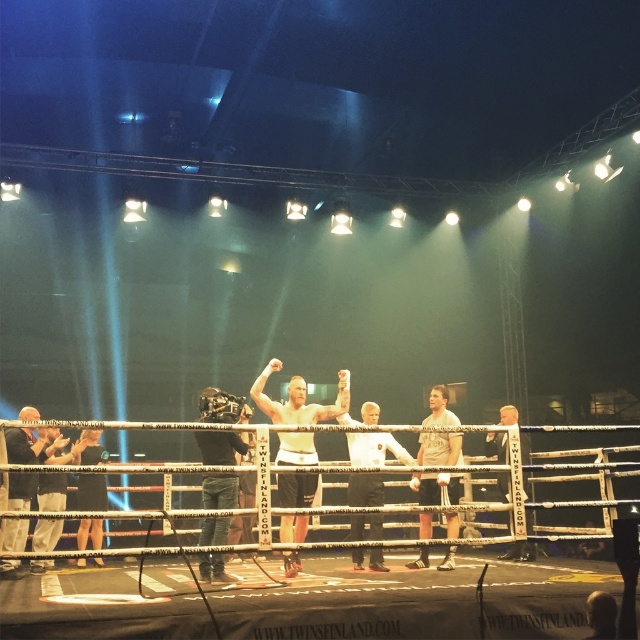
You are a photographer positioned at the back of the boxing ring. You want to take a photo that includes both the matte white shirt at center and the dark gray fabric jacket at left. Based on their sizes, which object will appear bigger in the photo?

The matte white shirt at center will appear bigger in the photo because it is larger in size than the dark gray fabric jacket at left.